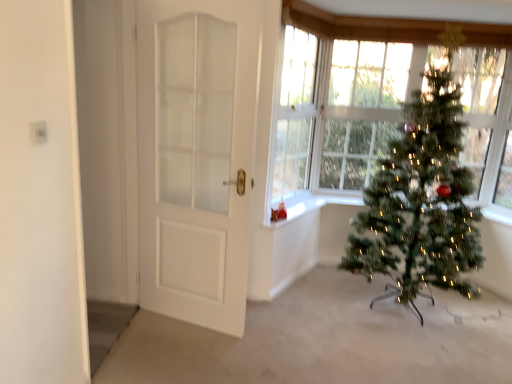
The height and width of the screenshot is (384, 512). Describe the element at coordinates (294, 118) in the screenshot. I see `clear glass window at center` at that location.

Locate an element on the screen. This screenshot has width=512, height=384. white matte door at left is located at coordinates (196, 155).

Image resolution: width=512 pixels, height=384 pixels. I want to click on white glossy window sill at center, so click(x=297, y=208).

Measure the distance between point (262, 224) and camera.

The distance of point (262, 224) from camera is 9.41 feet.

This screenshot has height=384, width=512. Identify the location of green artificial christmas tree at right. (421, 201).

I want to click on clear glass window at center, so click(x=294, y=118).

I want to click on christmas tree lying on the right of white matte door at left, so click(421, 201).

Is green artificial christmas tree at right placed right next to white matte door at left?

No.

How far apart are green artificial christmas tree at right and white matte door at left?

They are 1.20 meters apart.

Between green artificial christmas tree at right and white matte door at left, which one has more height?

white matte door at left.

Does green artificial christmas tree at right lie in front of clear glass window at center?

Yes, green artificial christmas tree at right is in front of clear glass window at center.

Does point (442, 119) come closer to viewer compared to point (298, 162)?

Yes, point (442, 119) is in front of point (298, 162).

Which object is wider, green artificial christmas tree at right or clear glass window at center?

Wider between the two is green artificial christmas tree at right.

Is green artificial christmas tree at right facing away from clear glass window at center?

Answer: green artificial christmas tree at right does not have its back to clear glass window at center.

Considering the positions of objects clear glass window at center and white glossy window sill at center in the image provided, who is in front, clear glass window at center or white glossy window sill at center?

clear glass window at center is more forward.

Is point (292, 200) closer to viewer compared to point (302, 202)?

Yes, point (292, 200) is closer to viewer.

Identify the location of window sill behind the clear glass window at center. (297, 208).

Is white glossy window sill at center surrounded by clear glass window at center?

No.

Considering the sizes of clear glass window at center and green artificial christmas tree at right in the image, is clear glass window at center wider or thinner than green artificial christmas tree at right?

Clearly, clear glass window at center has less width compared to green artificial christmas tree at right.

Where is `christmas tree in front of the clear glass window at center`? The height and width of the screenshot is (384, 512). christmas tree in front of the clear glass window at center is located at coordinates (421, 201).

Considering the positions of points (300, 64) and (440, 266), is point (300, 64) closer to camera compared to point (440, 266)?

No, it is not.

How different are the orientations of clear glass window at center and green artificial christmas tree at right in degrees?

They differ by 65.4 degrees in their facing directions.

Are white matte door at left and white glossy window sill at center located far from each other?

That's not correct — white matte door at left is a little close to white glossy window sill at center.

From a real-world perspective, is white matte door at left located higher than white glossy window sill at center?

Yes, from a real-world perspective, white matte door at left is over white glossy window sill at center

From the image's perspective, which object appears higher, white matte door at left or white glossy window sill at center?

white matte door at left is shown above in the image.

Is there a large distance between white glossy window sill at center and white matte door at left?

No.

Which is more to the right, white glossy window sill at center or white matte door at left?

Positioned to the right is white glossy window sill at center.

Considering the relative sizes of white glossy window sill at center and green artificial christmas tree at right in the image provided, is white glossy window sill at center thinner than green artificial christmas tree at right?

Yes, white glossy window sill at center is thinner than green artificial christmas tree at right.

Would you consider white glossy window sill at center to be distant from green artificial christmas tree at right?

No, white glossy window sill at center is not far away from green artificial christmas tree at right.

Is white glossy window sill at center positioned with its back to green artificial christmas tree at right?

white glossy window sill at center does not have its back to green artificial christmas tree at right.

Find the location of a particular element. christmas tree behind the white matte door at left is located at coordinates [421, 201].

At what (x,y) coordinates should I click in order to perform the action: click on christmas tree on the right of clear glass window at center. Please return your answer as a coordinate pair (x, y). The height and width of the screenshot is (384, 512). Looking at the image, I should click on (421, 201).

Based on their spatial positions, is white matte door at left or white glossy window sill at center closer to green artificial christmas tree at right?

Based on the image, white glossy window sill at center appears to be nearer to green artificial christmas tree at right.

Based on their spatial positions, is green artificial christmas tree at right or white matte door at left further from white glossy window sill at center?

green artificial christmas tree at right is further to white glossy window sill at center.

Looking at the image, which one is located closer to clear glass window at center, white matte door at left or green artificial christmas tree at right?

white matte door at left.

Based on their spatial positions, is white glossy window sill at center or green artificial christmas tree at right further from white matte door at left?

The object further to white matte door at left is green artificial christmas tree at right.

From the picture: Considering their positions, is clear glass window at center positioned further to white glossy window sill at center than green artificial christmas tree at right?

Based on the image, green artificial christmas tree at right appears to be further to white glossy window sill at center.

Estimate the real-world distances between objects in this image. Which object is closer to white matte door at left, green artificial christmas tree at right or white glossy window sill at center?

Among the two, white glossy window sill at center is located nearer to white matte door at left.

Considering their positions, is white matte door at left positioned closer to white glossy window sill at center than clear glass window at center?

clear glass window at center is closer to white glossy window sill at center.

Which object lies nearer to the anchor point green artificial christmas tree at right, white glossy window sill at center or white matte door at left?

white glossy window sill at center is positioned closer to the anchor green artificial christmas tree at right.

The height and width of the screenshot is (384, 512). What are the coordinates of `window between white matte door at left and green artificial christmas tree at right` in the screenshot? It's located at (294, 118).

This screenshot has height=384, width=512. Find the location of `window sill between clear glass window at center and green artificial christmas tree at right`. window sill between clear glass window at center and green artificial christmas tree at right is located at coordinates (297, 208).

Identify the location of window between white matte door at left and white glossy window sill at center from front to back. (294, 118).

Locate an element on the screen. Image resolution: width=512 pixels, height=384 pixels. window sill between white matte door at left and green artificial christmas tree at right in the horizontal direction is located at coordinates (297, 208).